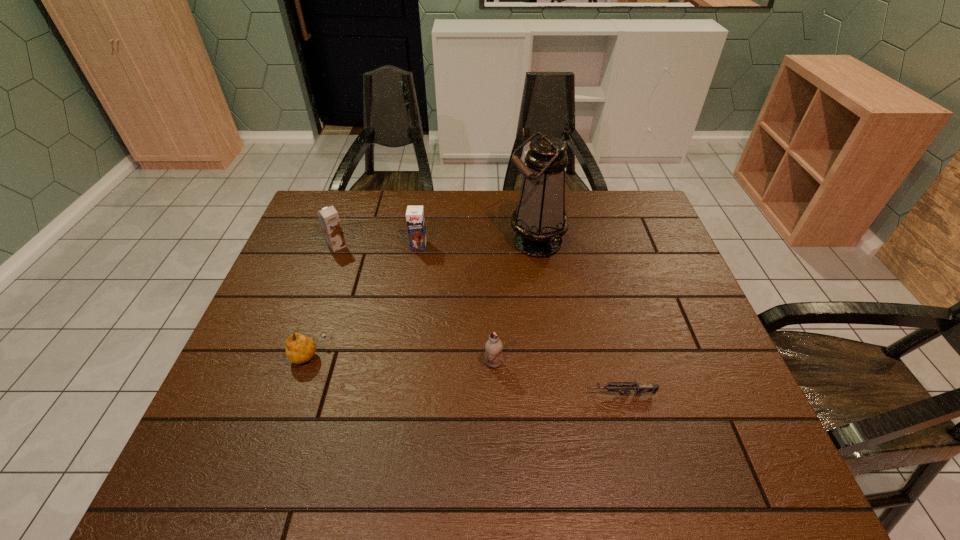
Identify the location of free space that satisfies the following two spatial constraints: 1. on the front side of the third shortest object; 2. on the right side of the leftmost chocolate milk. This screenshot has height=540, width=960. (295, 363).